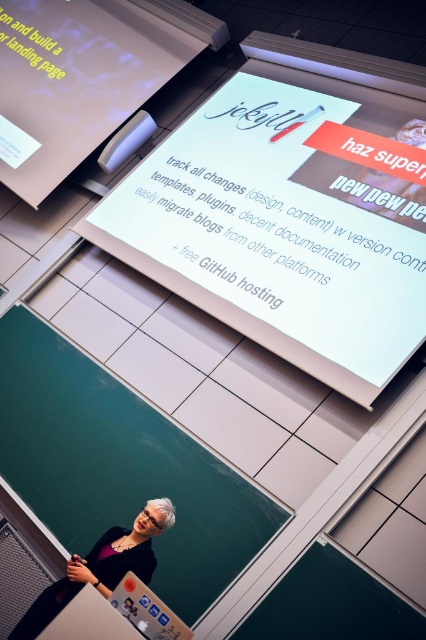
You are standing in a lecture hall and want to take a photo of the white glossy projection screen at upper center. The camera you have can focus clearly up to 10 feet away. Will the camera be able to capture the screen in focus?

The white glossy projection screen at upper center is 8.79 feet away from the camera, which is within the camera focus range of up to 10 feet. Therefore, the camera can capture the screen in focus.

You are an event organizer setting up for a tech conference. You have a white glossy projector screen at upper center and a white paper at upper left. Which object is taller?

The white glossy projector screen at upper center is taller than the white paper at upper left according to the description.

From the picture: You are an attendee at a tech conference. You notice the white glossy projection screen at upper center and the white paper at upper left. Which object is nearer to you?

The white glossy projection screen at upper center is closer to the viewer than the white paper at upper left.